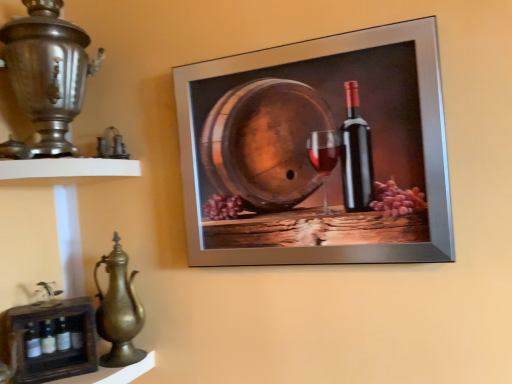
The width and height of the screenshot is (512, 384). Describe the element at coordinates (311, 147) in the screenshot. I see `metallic silver frame at upper center` at that location.

Image resolution: width=512 pixels, height=384 pixels. Describe the element at coordinates (119, 310) in the screenshot. I see `polished brass jug at lower left` at that location.

This screenshot has width=512, height=384. I want to click on polished brass jug at lower left, so click(x=119, y=310).

What is the approximate width of white matte shelf at left, marked as the first shelf in a top-to-bottom arrangement?

white matte shelf at left, marked as the first shelf in a top-to-bottom arrangement, is 9.81 inches in width.

Measure the distance between white matte shelf at left, the second shelf positioned from the bottom, and camera.

A distance of 32.80 inches exists between white matte shelf at left, the second shelf positioned from the bottom, and camera.

Where is `polished silver samovar at left`? This screenshot has width=512, height=384. polished silver samovar at left is located at coordinates (48, 72).

Considering the sizes of polished brass jug at lower left and white matte shelf at left, the second shelf positioned from the bottom, in the image, is polished brass jug at lower left wider or thinner than white matte shelf at left, the second shelf positioned from the bottom,?

Considering their sizes, polished brass jug at lower left looks slimmer than white matte shelf at left, the second shelf positioned from the bottom.

At what (x,y) coordinates should I click in order to perform the action: click on shelf that is the 2nd one when counting leftward from the polished brass jug at lower left. Please return your answer as a coordinate pair (x, y). The height and width of the screenshot is (384, 512). Looking at the image, I should click on (67, 168).

Do you think polished brass jug at lower left is within white matte shelf at left, marked as the first shelf in a top-to-bottom arrangement, or outside of it?

The correct answer is: outside.

From a real-world perspective, is polished brass jug at lower left positioned above or below white matte shelf at left, marked as the first shelf in a top-to-bottom arrangement?

In terms of real-world spatial position, polished brass jug at lower left is below white matte shelf at left, marked as the first shelf in a top-to-bottom arrangement.

Between polished brass jug at lower left and metallic silver frame at upper center, which one has larger size?

metallic silver frame at upper center is bigger.

Is polished brass jug at lower left situated inside metallic silver frame at upper center or outside?

polished brass jug at lower left is not inside metallic silver frame at upper center, it's outside.

Is polished brass jug at lower left facing away from metallic silver frame at upper center?

polished brass jug at lower left does not have its back to metallic silver frame at upper center.

Is polished brass jug at lower left positioned far away from metallic silver frame at upper center?

No, polished brass jug at lower left is not far away from metallic silver frame at upper center.

From the image's perspective, does wooden crate at lower left, which appears as the 1th shelf when ordered from the bottom, appear lower than white matte shelf at left, the second shelf positioned from the bottom?

Yes, from the image's perspective, wooden crate at lower left, which appears as the 1th shelf when ordered from the bottom, is beneath white matte shelf at left, the second shelf positioned from the bottom.

Which object is further away from the camera, wooden crate at lower left, which appears as the 1th shelf when ordered from the bottom, or white matte shelf at left, marked as the first shelf in a top-to-bottom arrangement?

wooden crate at lower left, which appears as the 1th shelf when ordered from the bottom, is further away from the camera.

Is wooden crate at lower left, arranged as the second shelf when viewed from the top, oriented away from white matte shelf at left, the second shelf positioned from the bottom?

wooden crate at lower left, arranged as the second shelf when viewed from the top, does not have its back to white matte shelf at left, the second shelf positioned from the bottom.

Is polished silver samovar at left to the right of polished brass jug at lower left from the viewer's perspective?

No.

Is polished silver samovar at left positioned far away from polished brass jug at lower left?

No, there isn't a large distance between polished silver samovar at left and polished brass jug at lower left.

Considering the sizes of objects polished silver samovar at left and polished brass jug at lower left in the image provided, who is bigger, polished silver samovar at left or polished brass jug at lower left?

polished silver samovar at left.

Considering the relative positions of polished silver samovar at left and polished brass jug at lower left in the image provided, is polished silver samovar at left behind polished brass jug at lower left?

No, it is in front of polished brass jug at lower left.

Considering the sizes of objects wooden crate at lower left, which appears as the 1th shelf when ordered from the bottom, and polished silver samovar at left in the image provided, who is wider, wooden crate at lower left, which appears as the 1th shelf when ordered from the bottom, or polished silver samovar at left?

With larger width is polished silver samovar at left.

Which is closer to the camera, (26, 332) or (59, 11)?

Point (26, 332) appears to be farther away from the viewer than point (59, 11).

From a real-world perspective, who is located higher, wooden crate at lower left, arranged as the second shelf when viewed from the top, or polished silver samovar at left?

polished silver samovar at left.

Is wooden crate at lower left, which appears as the 1th shelf when ordered from the bottom, taller than polished silver samovar at left?

No.

Who is bigger, metallic silver frame at upper center or polished brass jug at lower left?

metallic silver frame at upper center.

Considering the sizes of objects metallic silver frame at upper center and polished brass jug at lower left in the image provided, who is shorter, metallic silver frame at upper center or polished brass jug at lower left?

Standing shorter between the two is polished brass jug at lower left.

Which object is wider, metallic silver frame at upper center or polished brass jug at lower left?

polished brass jug at lower left.

Does metallic silver frame at upper center touch polished brass jug at lower left?

No, metallic silver frame at upper center is not with polished brass jug at lower left.

Can you tell me how much metallic silver frame at upper center and polished silver samovar at left differ in facing direction?

The angular difference between metallic silver frame at upper center and polished silver samovar at left is 54.7 degrees.

Is metallic silver frame at upper center far from polished silver samovar at left?

No, metallic silver frame at upper center is not far away from polished silver samovar at left.

Considering the sizes of metallic silver frame at upper center and polished silver samovar at left in the image, is metallic silver frame at upper center taller or shorter than polished silver samovar at left?

Clearly, metallic silver frame at upper center is taller compared to polished silver samovar at left.

Choose the correct answer: Is metallic silver frame at upper center inside polished silver samovar at left or outside it?

metallic silver frame at upper center is spatially situated outside polished silver samovar at left.

At what (x,y) coordinates should I click in order to perform the action: click on shelf lying above the polished brass jug at lower left (from the image's perspective). Please return your answer as a coordinate pair (x, y). Image resolution: width=512 pixels, height=384 pixels. Looking at the image, I should click on (67, 168).

Locate an element on the screen. The height and width of the screenshot is (384, 512). picture frame above the polished brass jug at lower left (from a real-world perspective) is located at coordinates (311, 147).

Estimate the real-world distances between objects in this image. Which object is further from wooden crate at lower left, arranged as the second shelf when viewed from the top, metallic silver frame at upper center or white matte shelf at left, the second shelf positioned from the bottom?

Based on the image, metallic silver frame at upper center appears to be further to wooden crate at lower left, arranged as the second shelf when viewed from the top.

Based on their spatial positions, is polished silver samovar at left or metallic silver frame at upper center closer to polished brass jug at lower left?

The object closer to polished brass jug at lower left is polished silver samovar at left.

When comparing their distances from polished brass jug at lower left, does polished silver samovar at left or wooden crate at lower left, which appears as the 1th shelf when ordered from the bottom, seem further?

polished silver samovar at left lies further to polished brass jug at lower left than the other object.

When comparing their distances from metallic silver frame at upper center, does white matte shelf at left, the second shelf positioned from the bottom, or polished brass jug at lower left seem further?

polished brass jug at lower left is further to metallic silver frame at upper center.

From the image, which object appears to be farther from white matte shelf at left, the second shelf positioned from the bottom, wooden crate at lower left, arranged as the second shelf when viewed from the top, or polished brass jug at lower left?

wooden crate at lower left, arranged as the second shelf when viewed from the top, is positioned further to the anchor white matte shelf at left, the second shelf positioned from the bottom.

Considering their positions, is polished brass jug at lower left positioned further to white matte shelf at left, the second shelf positioned from the bottom, than wooden crate at lower left, arranged as the second shelf when viewed from the top?

wooden crate at lower left, arranged as the second shelf when viewed from the top, is further to white matte shelf at left, the second shelf positioned from the bottom.

When comparing their distances from white matte shelf at left, the second shelf positioned from the bottom, does polished brass jug at lower left or metallic silver frame at upper center seem further?

Based on the image, metallic silver frame at upper center appears to be further to white matte shelf at left, the second shelf positioned from the bottom.

Estimate the real-world distances between objects in this image. Which object is closer to white matte shelf at left, the second shelf positioned from the bottom, polished silver samovar at left or polished brass jug at lower left?

polished silver samovar at left lies closer to white matte shelf at left, the second shelf positioned from the bottom, than the other object.

At what (x,y) coordinates should I click in order to perform the action: click on shelf between polished silver samovar at left and wooden crate at lower left, which appears as the 1th shelf when ordered from the bottom, in the vertical direction. Please return your answer as a coordinate pair (x, y). The image size is (512, 384). Looking at the image, I should click on coord(67,168).

This screenshot has width=512, height=384. I want to click on jug that lies between white matte shelf at left, the second shelf positioned from the bottom, and wooden crate at lower left, arranged as the second shelf when viewed from the top, from top to bottom, so click(119, 310).

Locate an element on the screen. Image resolution: width=512 pixels, height=384 pixels. jug located between polished silver samovar at left and metallic silver frame at upper center in the left-right direction is located at coordinates (119, 310).

This screenshot has width=512, height=384. I want to click on shelf between polished silver samovar at left and polished brass jug at lower left from top to bottom, so click(67, 168).